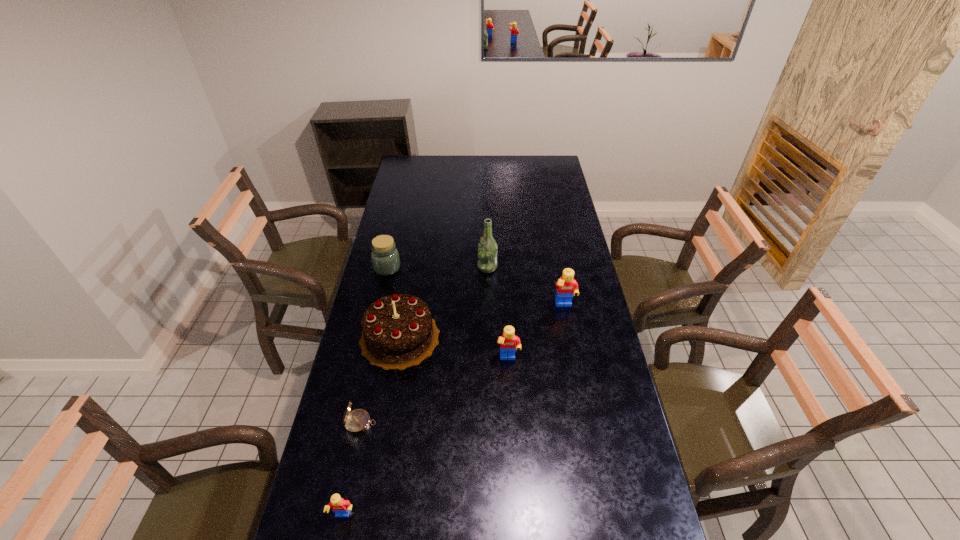
This screenshot has width=960, height=540. In order to click on jar that is at the left edge in this screenshot , I will do `click(385, 258)`.

Where is `birthday cake at the left edge`? birthday cake at the left edge is located at coordinates (398, 331).

The image size is (960, 540). I want to click on compass located at the left edge, so click(x=356, y=422).

The height and width of the screenshot is (540, 960). In order to click on object positioned at the right edge in this screenshot , I will do `click(566, 286)`.

Identify the location of object that is at the near left corner. (341, 507).

In the image, there is a desktop. Identify the location of vacant space at the far edge. The image size is (960, 540). (469, 170).

The width and height of the screenshot is (960, 540). I want to click on vacant region at the left edge, so click(x=408, y=182).

The height and width of the screenshot is (540, 960). In order to click on vacant space at the right edge of the desktop in this screenshot , I will do `click(558, 181)`.

Locate an element on the screen. The width and height of the screenshot is (960, 540). free space at the far left corner of the desktop is located at coordinates (420, 160).

The width and height of the screenshot is (960, 540). I want to click on free spot between the rightmost object and the compass, so click(462, 364).